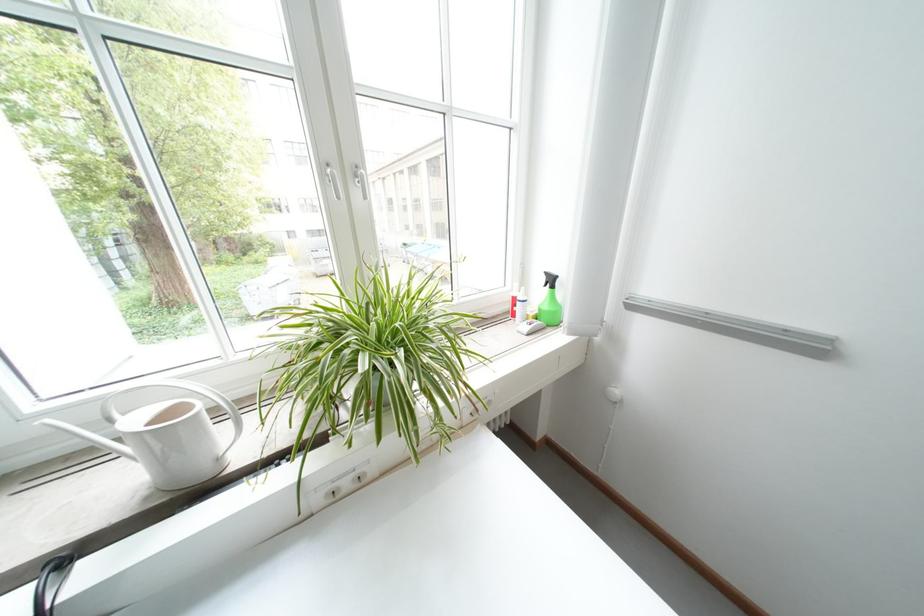
The location [550,302] corresponds to which object?

This point indicates the green spray bottle.